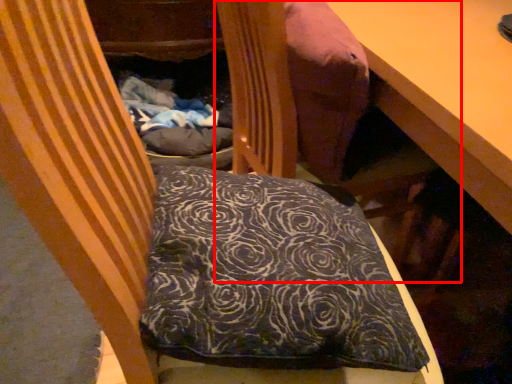
Question: From the image's perspective, where is bean bag chair (annotated by the red box) located relative to pillow?

Choices:
 (A) above
 (B) below

Answer: (A)